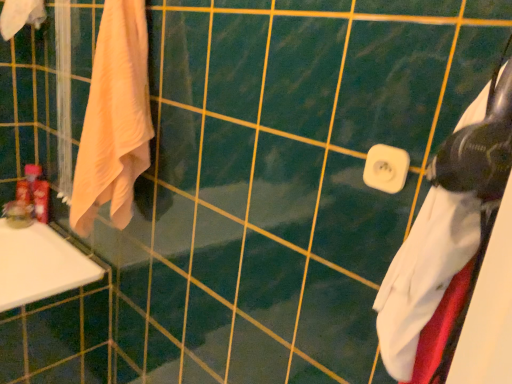
What do you see at coordinates (20, 16) in the screenshot? The height and width of the screenshot is (384, 512). I see `beige cotton towel at upper left, positioned as the 3th towel in right-to-left order` at bounding box center [20, 16].

The height and width of the screenshot is (384, 512). In order to click on matte plastic toothpaste tube at left, the 2th toiletry in the left-to-right sequence in this screenshot , I will do `click(41, 197)`.

What do you see at coordinates (114, 119) in the screenshot? I see `light peach cotton towel at left, the second towel when ordered from front to back` at bounding box center [114, 119].

What do you see at coordinates (450, 240) in the screenshot? The height and width of the screenshot is (384, 512). I see `white matte towel at right, positioned as the 1th towel in right-to-left order` at bounding box center [450, 240].

Identify the location of beige cotton towel at upper left, marked as the third towel in a front-to-back arrangement. This screenshot has width=512, height=384. (20, 16).

Based on their positions, is matte plastic toiletries at left, acting as the 2th toiletry starting from the right, located to the left or right of beige cotton towel at upper left, placed as the 1th towel when sorted from left to right?

From the image, it's evident that matte plastic toiletries at left, acting as the 2th toiletry starting from the right, is to the left of beige cotton towel at upper left, placed as the 1th towel when sorted from left to right.

Considering the points (30, 188) and (5, 28), which point is in front, point (30, 188) or point (5, 28)?

Point (5, 28)

What's the angular difference between matte plastic toiletries at left, the first toiletry positioned from the left, and beige cotton towel at upper left, positioned as the 3th towel in right-to-left order,'s facing directions?

They differ by 90 degrees in their facing directions.

Is beige cotton towel at upper left, placed as the 1th towel when sorted from left to right, at the back of matte plastic toiletries at left, the first toiletry positioned from the left?

No, beige cotton towel at upper left, placed as the 1th towel when sorted from left to right, is not at the back of matte plastic toiletries at left, the first toiletry positioned from the left.

Can you confirm if beige cotton towel at upper left, marked as the third towel in a front-to-back arrangement, is smaller than matte plastic toiletries at left, acting as the 2th toiletry starting from the right?

No.

Is beige cotton towel at upper left, which appears as the 1th towel when viewed from the back, positioned with its back to matte plastic toiletries at left, the first toiletry positioned from the left?

beige cotton towel at upper left, which appears as the 1th towel when viewed from the back, does not have its back to matte plastic toiletries at left, the first toiletry positioned from the left.

Is the depth of beige cotton towel at upper left, which appears as the 1th towel when viewed from the back, less than that of matte plastic toiletries at left, the first toiletry positioned from the left?

Yes, it is in front of matte plastic toiletries at left, the first toiletry positioned from the left.

Is point (40, 217) farther from camera compared to point (115, 102)?

Yes, it is behind point (115, 102).

Who is taller, matte plastic toothpaste tube at left, positioned as the first toiletry in right-to-left order, or light peach cotton towel at left, positioned as the 2th towel in back-to-front order?

light peach cotton towel at left, positioned as the 2th towel in back-to-front order, is taller.

Looking at this image, is matte plastic toothpaste tube at left, the 2th toiletry in the left-to-right sequence, next to light peach cotton towel at left, which appears as the second towel when viewed from the left, and touching it?

They are not placed beside each other.

Considering the positions of objects matte plastic toothpaste tube at left, the 2th toiletry in the left-to-right sequence, and light peach cotton towel at left, arranged as the second towel when viewed from the right, in the image provided, who is more to the left, matte plastic toothpaste tube at left, the 2th toiletry in the left-to-right sequence, or light peach cotton towel at left, arranged as the second towel when viewed from the right,?

Positioned to the left is matte plastic toothpaste tube at left, the 2th toiletry in the left-to-right sequence.

From a real-world perspective, is white matte towel at right, which ranks as the third towel in back-to-front order, above or below light peach cotton towel at left, arranged as the second towel when viewed from the right?

In terms of real-world spatial position, white matte towel at right, which ranks as the third towel in back-to-front order, is above light peach cotton towel at left, arranged as the second towel when viewed from the right.

Does white matte towel at right, positioned as the 1th towel in right-to-left order, appear on the left side of light peach cotton towel at left, positioned as the 2th towel in back-to-front order?

No, white matte towel at right, positioned as the 1th towel in right-to-left order, is not to the left of light peach cotton towel at left, positioned as the 2th towel in back-to-front order.

How many degrees apart are the facing directions of white matte towel at right, the 1th towel positioned from the front, and light peach cotton towel at left, arranged as the second towel when viewed from the right?

The facing directions of white matte towel at right, the 1th towel positioned from the front, and light peach cotton towel at left, arranged as the second towel when viewed from the right, are 89.3 degrees apart.

Is point (402, 300) positioned in front of point (135, 180)?

Yes, point (402, 300) is closer to viewer.

Is white plastic towel bar at center turned away from light peach cotton towel at left, arranged as the second towel when viewed from the right?

No, white plastic towel bar at center's orientation is not away from light peach cotton towel at left, arranged as the second towel when viewed from the right.

Would you say white plastic towel bar at center is inside or outside light peach cotton towel at left, which appears as the second towel when viewed from the left?

white plastic towel bar at center cannot be found inside light peach cotton towel at left, which appears as the second towel when viewed from the left.

From the image's perspective, is white plastic towel bar at center above or below white matte towel at right, the 1th towel positioned from the front?

white plastic towel bar at center is above white matte towel at right, the 1th towel positioned from the front.

Looking at the image, does white plastic towel bar at center seem bigger or smaller compared to white matte towel at right, positioned as the 1th towel in right-to-left order?

Clearly, white plastic towel bar at center is smaller in size than white matte towel at right, positioned as the 1th towel in right-to-left order.

Considering the relative sizes of beige cotton towel at upper left, which appears as the 1th towel when viewed from the back, and white plastic towel bar at center in the image provided, is beige cotton towel at upper left, which appears as the 1th towel when viewed from the back, shorter than white plastic towel bar at center?

Incorrect, the height of beige cotton towel at upper left, which appears as the 1th towel when viewed from the back, does not fall short of that of white plastic towel bar at center.

Does beige cotton towel at upper left, positioned as the 3th towel in right-to-left order, have a lesser width compared to white plastic towel bar at center?

No, beige cotton towel at upper left, positioned as the 3th towel in right-to-left order, is not thinner than white plastic towel bar at center.

Which object is positioned more to the left, beige cotton towel at upper left, marked as the third towel in a front-to-back arrangement, or white plastic towel bar at center?

From the viewer's perspective, beige cotton towel at upper left, marked as the third towel in a front-to-back arrangement, appears more on the left side.

From a real-world perspective, is beige cotton towel at upper left, positioned as the 3th towel in right-to-left order, above or below white plastic towel bar at center?

From a real-world perspective, beige cotton towel at upper left, positioned as the 3th towel in right-to-left order, is physically above white plastic towel bar at center.

Starting from the matte plastic toiletries at left, acting as the 2th toiletry starting from the right, which towel is the 1st one in front? Please provide its 2D coordinates.

[(20, 16)]

The width and height of the screenshot is (512, 384). In order to click on the 3rd towel above the matte plastic toiletries at left, the first toiletry positioned from the left (from the image's perspective) in this screenshot , I will do `click(20, 16)`.

Based on their spatial positions, is light peach cotton towel at left, which appears as the second towel when viewed from the left, or matte plastic toiletries at left, the first toiletry positioned from the left, closer to white matte towel at right, which ranks as the third towel in back-to-front order?

light peach cotton towel at left, which appears as the second towel when viewed from the left.

Based on their spatial positions, is white plastic towel bar at center or beige cotton towel at upper left, marked as the third towel in a front-to-back arrangement, closer to matte plastic toothpaste tube at left, positioned as the first toiletry in right-to-left order?

beige cotton towel at upper left, marked as the third towel in a front-to-back arrangement.

From the picture: Looking at the image, which one is located further to matte plastic toiletries at left, the first toiletry positioned from the left, light peach cotton towel at left, the second towel when ordered from front to back, or matte plastic toothpaste tube at left, the 2th toiletry in the left-to-right sequence?

The object further to matte plastic toiletries at left, the first toiletry positioned from the left, is light peach cotton towel at left, the second towel when ordered from front to back.

Considering their positions, is white plastic towel bar at center positioned further to white matte towel at right, the 1th towel positioned from the front, than beige cotton towel at upper left, placed as the 1th towel when sorted from left to right?

Based on the image, beige cotton towel at upper left, placed as the 1th towel when sorted from left to right, appears to be further to white matte towel at right, the 1th towel positioned from the front.

In the scene shown: From the image, which object appears to be farther from beige cotton towel at upper left, marked as the third towel in a front-to-back arrangement, white plastic towel bar at center or white matte towel at right, positioned as the 1th towel in right-to-left order?

white matte towel at right, positioned as the 1th towel in right-to-left order.

When comparing their distances from matte plastic toiletries at left, acting as the 2th toiletry starting from the right, does white plastic towel bar at center or white matte towel at right, which appears as the 3th towel when viewed from the left, seem closer?

white plastic towel bar at center lies closer to matte plastic toiletries at left, acting as the 2th toiletry starting from the right, than the other object.

Estimate the real-world distances between objects in this image. Which object is closer to beige cotton towel at upper left, marked as the third towel in a front-to-back arrangement, white matte towel at right, the 1th towel positioned from the front, or matte plastic toiletries at left, acting as the 2th toiletry starting from the right?

matte plastic toiletries at left, acting as the 2th toiletry starting from the right, is positioned closer to the anchor beige cotton towel at upper left, marked as the third towel in a front-to-back arrangement.

Consider the image. Considering their positions, is matte plastic toothpaste tube at left, the 2th toiletry in the left-to-right sequence, positioned further to matte plastic toiletries at left, acting as the 2th toiletry starting from the right, than white plastic towel bar at center?

The object further to matte plastic toiletries at left, acting as the 2th toiletry starting from the right, is white plastic towel bar at center.

Where is `toiletry between white matte towel at right, which ranks as the third towel in back-to-front order, and matte plastic toiletries at left, the first toiletry positioned from the left, from front to back`? The height and width of the screenshot is (384, 512). toiletry between white matte towel at right, which ranks as the third towel in back-to-front order, and matte plastic toiletries at left, the first toiletry positioned from the left, from front to back is located at coordinates (41, 197).

Find the location of a particular element. Image resolution: width=512 pixels, height=384 pixels. towel between light peach cotton towel at left, arranged as the second towel when viewed from the right, and matte plastic toothpaste tube at left, positioned as the first toiletry in right-to-left order, along the z-axis is located at coordinates click(20, 16).

You are a GUI agent. You are given a task and a screenshot of the screen. Output one action in this format:
    pyautogui.click(x=<x>, y=<y>)
    Task: Click on the towel between light peach cotton towel at left, positioned as the 2th towel in back-to-front order, and matte plastic toiletries at left, acting as the 2th toiletry starting from the right, from front to back
    This screenshot has height=384, width=512.
    Given the screenshot: What is the action you would take?
    pyautogui.click(x=20, y=16)

Find the location of `towel bar between light peach cotton towel at left, which appears as the second towel when viewed from the left, and white matte towel at right, which ranks as the third towel in back-to-front order, from left to right`. towel bar between light peach cotton towel at left, which appears as the second towel when viewed from the left, and white matte towel at right, which ranks as the third towel in back-to-front order, from left to right is located at coordinates (386, 168).